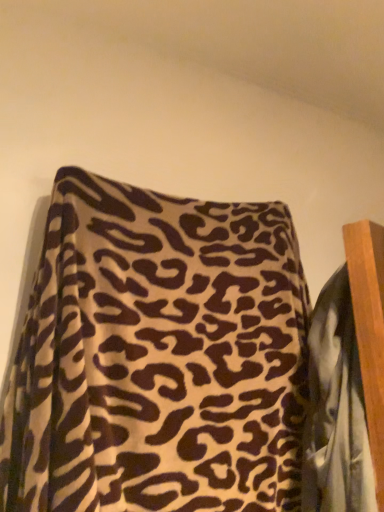
Question: Is leopard print fabric at upper center at the back of leopard print fabric at center?

Choices:
 (A) no
 (B) yes

Answer: (B)

Question: Does leopard print fabric at center come behind leopard print fabric at upper center?

Choices:
 (A) yes
 (B) no

Answer: (A)

Question: Is leopard print fabric at center outside leopard print fabric at upper center?

Choices:
 (A) no
 (B) yes

Answer: (A)

Question: Is leopard print fabric at center shorter than leopard print fabric at upper center?

Choices:
 (A) yes
 (B) no

Answer: (A)

Question: Is leopard print fabric at center thinner than leopard print fabric at upper center?

Choices:
 (A) yes
 (B) no

Answer: (A)

Question: Does leopard print fabric at center turn towards leopard print fabric at upper center?

Choices:
 (A) yes
 (B) no

Answer: (A)

Question: From a real-world perspective, is leopard print fabric at upper center on leopard print fabric at center?

Choices:
 (A) no
 (B) yes

Answer: (B)

Question: Is leopard print fabric at upper center bigger than leopard print fabric at center?

Choices:
 (A) yes
 (B) no

Answer: (A)

Question: Can you confirm if leopard print fabric at upper center is thinner than leopard print fabric at center?

Choices:
 (A) yes
 (B) no

Answer: (B)

Question: Considering the relative sizes of leopard print fabric at upper center and leopard print fabric at center in the image provided, is leopard print fabric at upper center smaller than leopard print fabric at center?

Choices:
 (A) no
 (B) yes

Answer: (A)

Question: Are leopard print fabric at upper center and leopard print fabric at center beside each other?

Choices:
 (A) no
 (B) yes

Answer: (A)

Question: Does leopard print fabric at upper center turn towards leopard print fabric at center?

Choices:
 (A) no
 (B) yes

Answer: (B)

Question: From a real-world perspective, is leopard print fabric at upper center above or below leopard print fabric at center?

Choices:
 (A) above
 (B) below

Answer: (A)